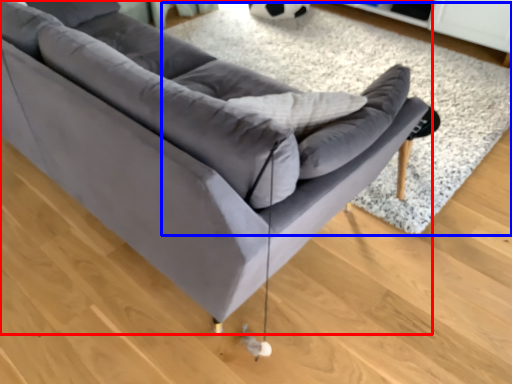
Question: Which object appears farthest to the camera in this image, studio couch (highlighted by a red box) or mat (highlighted by a blue box)?

Choices:
 (A) studio couch
 (B) mat

Answer: (B)